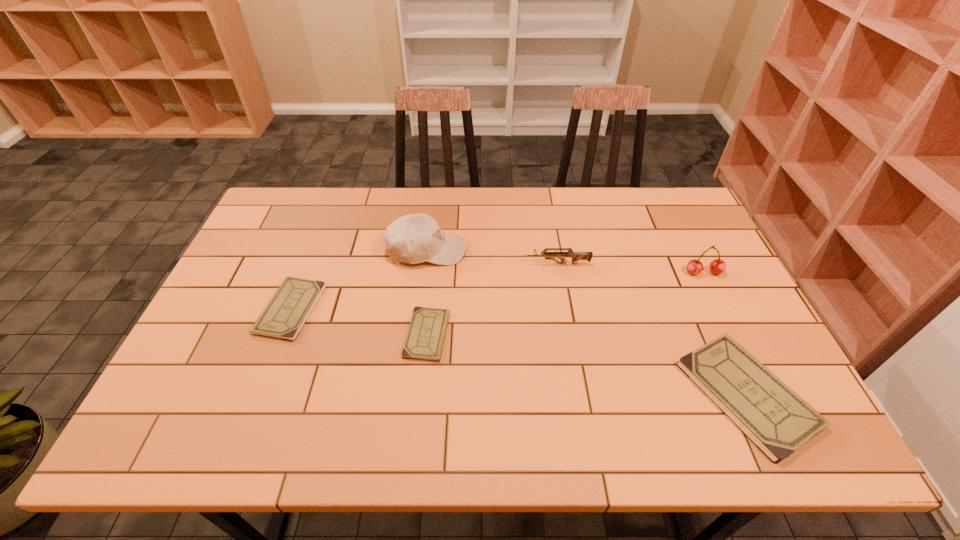
Locate an element on the screen. the second shortest checkbook is located at coordinates tap(286, 313).

Locate an element on the screen. the leftmost object is located at coordinates (286, 313).

In order to click on the shortest checkbook in this screenshot , I will do `click(427, 329)`.

Identify the location of the shortest object. (427, 329).

At what (x,y) coordinates should I click in order to perform the action: click on the tallest checkbook. Please return your answer as a coordinate pair (x, y). The width and height of the screenshot is (960, 540). Looking at the image, I should click on (778, 421).

At what (x,y) coordinates should I click in order to perform the action: click on the rightmost checkbook. Please return your answer as a coordinate pair (x, y). The image size is (960, 540). Looking at the image, I should click on (778, 421).

Find the location of a particular element. This screenshot has height=540, width=960. gun is located at coordinates (575, 256).

Locate an element on the screen. This screenshot has width=960, height=540. the third tallest object is located at coordinates (575, 256).

Image resolution: width=960 pixels, height=540 pixels. I want to click on baseball cap, so click(415, 238).

This screenshot has width=960, height=540. What are the coordinates of `cherry` in the screenshot? It's located at (717, 266).